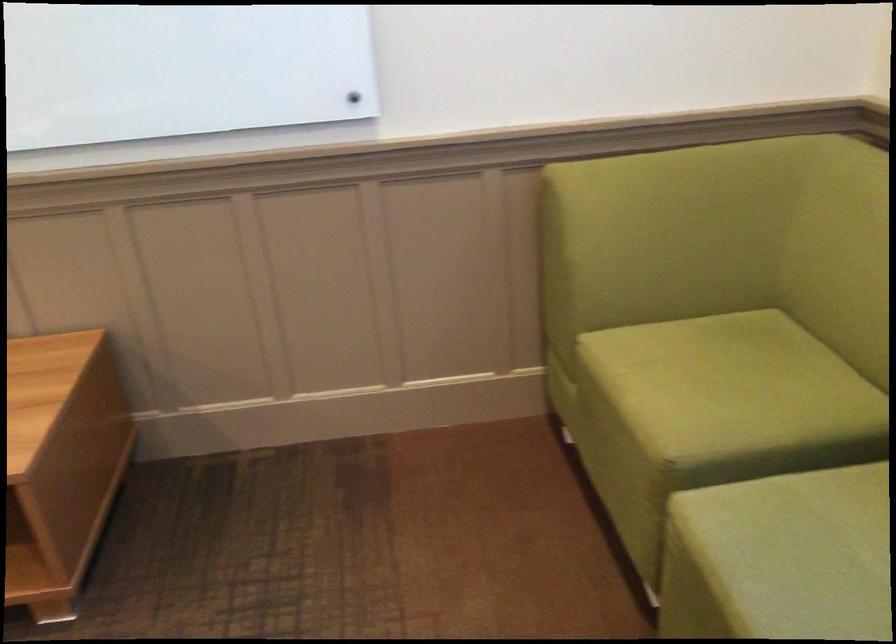
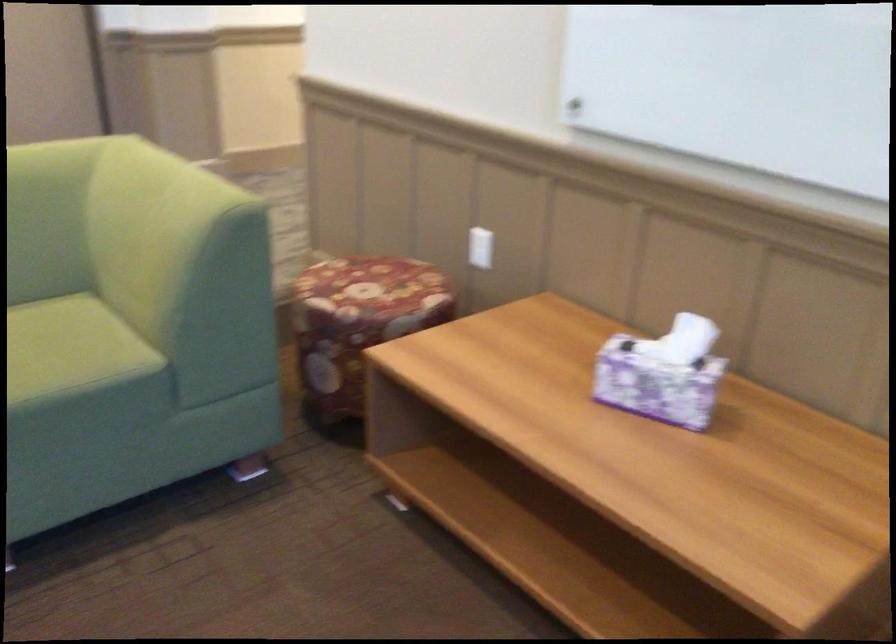
Question: The camera is either moving clockwise (left) or counter-clockwise (right) around the object. The first image is from the beginning of the video and the second image is from the end. Is the camera moving left or right when shooting the video?

Choices:
 (A) Left
 (B) Right

Answer: (B)